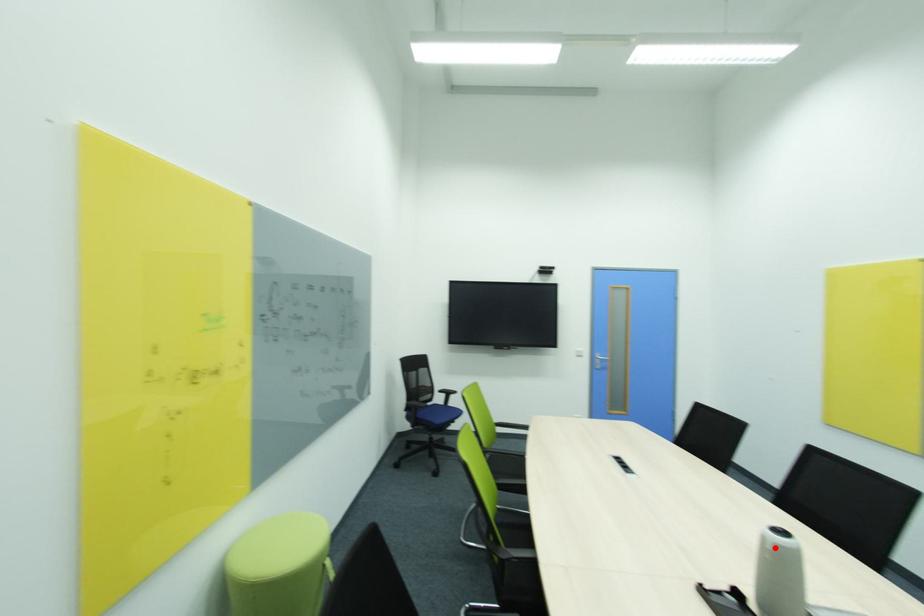
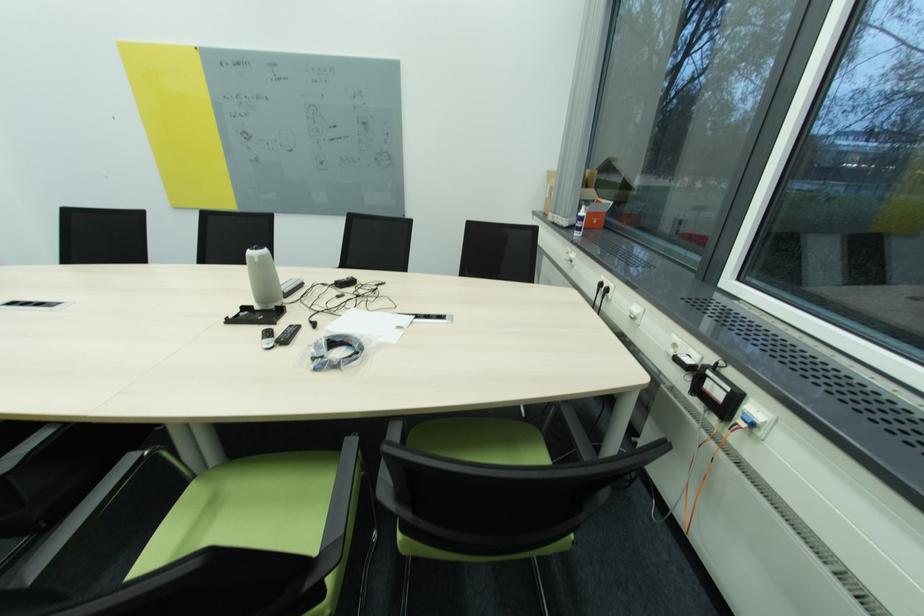
The point at the highlighted location is marked in the first image. Where is the corresponding point in the second image?

(261, 262)